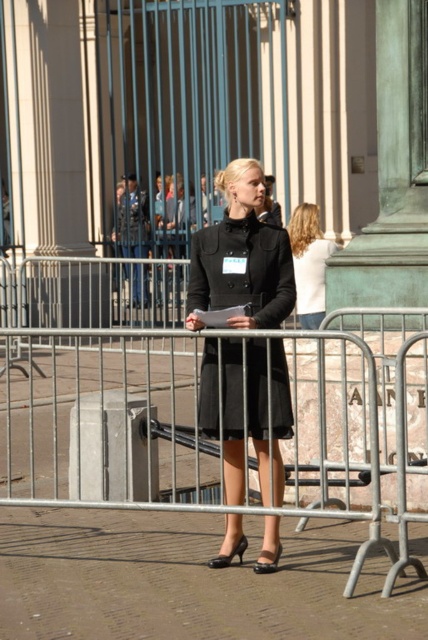
You are standing at the center of the image. Where exactly is the metallic silver fence at center located?

The metallic silver fence at center is located at point (223, 422).

You are attending an event and notice the metallic silver fence at center and the black woolen coat at center. Which object appears closer to the front of the image?

The metallic silver fence at center is positioned under the black woolen coat at center, so the black woolen coat at center appears closer to the front.